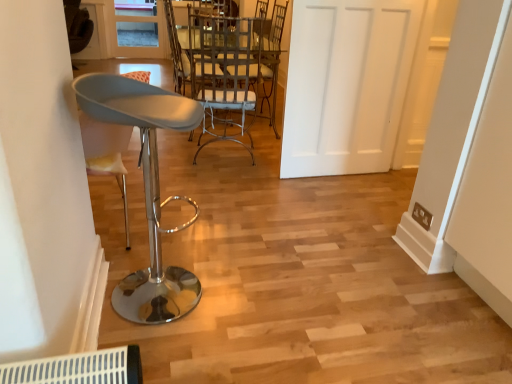
Question: Is matte gray stool at left, which appears as the first chair when viewed from the front, aimed at clear glass door at upper center?

Choices:
 (A) yes
 (B) no

Answer: (B)

Question: Is matte gray stool at left, which appears as the first chair when viewed from the front, closer to the viewer compared to clear glass door at upper center?

Choices:
 (A) no
 (B) yes

Answer: (B)

Question: Does matte gray stool at left, which appears as the first chair when viewed from the front, have a smaller size compared to clear glass door at upper center?

Choices:
 (A) no
 (B) yes

Answer: (A)

Question: Does matte gray stool at left, which appears as the first chair when viewed from the front, have a greater width compared to clear glass door at upper center?

Choices:
 (A) yes
 (B) no

Answer: (A)

Question: Considering the relative sizes of matte gray stool at left, which appears as the first chair when viewed from the front, and clear glass door at upper center in the image provided, is matte gray stool at left, which appears as the first chair when viewed from the front, taller than clear glass door at upper center?

Choices:
 (A) yes
 (B) no

Answer: (B)

Question: Considering the relative sizes of matte gray stool at left, which appears as the first chair when viewed from the front, and clear glass door at upper center in the image provided, is matte gray stool at left, which appears as the first chair when viewed from the front, shorter than clear glass door at upper center?

Choices:
 (A) yes
 (B) no

Answer: (A)

Question: From the image's perspective, does clear glass door at upper center appear lower than matte gray stool at left, marked as the 2th chair in a back-to-front arrangement?

Choices:
 (A) no
 (B) yes

Answer: (A)

Question: Are clear glass door at upper center and matte gray stool at left, which appears as the first chair when viewed from the front, making contact?

Choices:
 (A) yes
 (B) no

Answer: (B)

Question: Is clear glass door at upper center in front of matte gray stool at left, which appears as the first chair when viewed from the front?

Choices:
 (A) no
 (B) yes

Answer: (A)

Question: From the image's perspective, is clear glass door at upper center above matte gray stool at left, marked as the 2th chair in a back-to-front arrangement?

Choices:
 (A) no
 (B) yes

Answer: (B)

Question: Are clear glass door at upper center and matte gray stool at left, marked as the 2th chair in a back-to-front arrangement, located far from each other?

Choices:
 (A) yes
 (B) no

Answer: (A)

Question: Is clear glass door at upper center looking in the opposite direction of matte gray stool at left, which appears as the first chair when viewed from the front?

Choices:
 (A) no
 (B) yes

Answer: (A)

Question: Does white matte door at center have a lesser height compared to clear glass door at upper center?

Choices:
 (A) yes
 (B) no

Answer: (B)